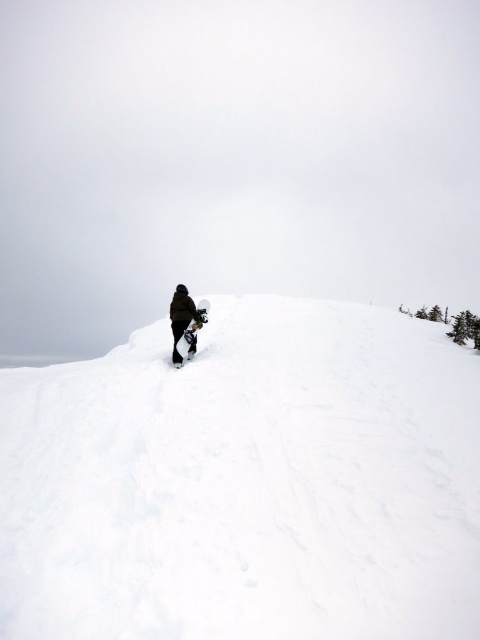
Question: Where is white fluffy snow at center located in relation to dark brown snowboarder at center in the image?

Choices:
 (A) left
 (B) right

Answer: (B)

Question: Does white fluffy snow at center appear over dark brown snowboarder at center?

Choices:
 (A) no
 (B) yes

Answer: (A)

Question: Does white fluffy snow at center appear under dark brown snowboarder at center?

Choices:
 (A) no
 (B) yes

Answer: (B)

Question: Among these objects, which one is nearest to the camera?

Choices:
 (A) dark brown snowboarder at center
 (B) white fluffy snow at center

Answer: (B)